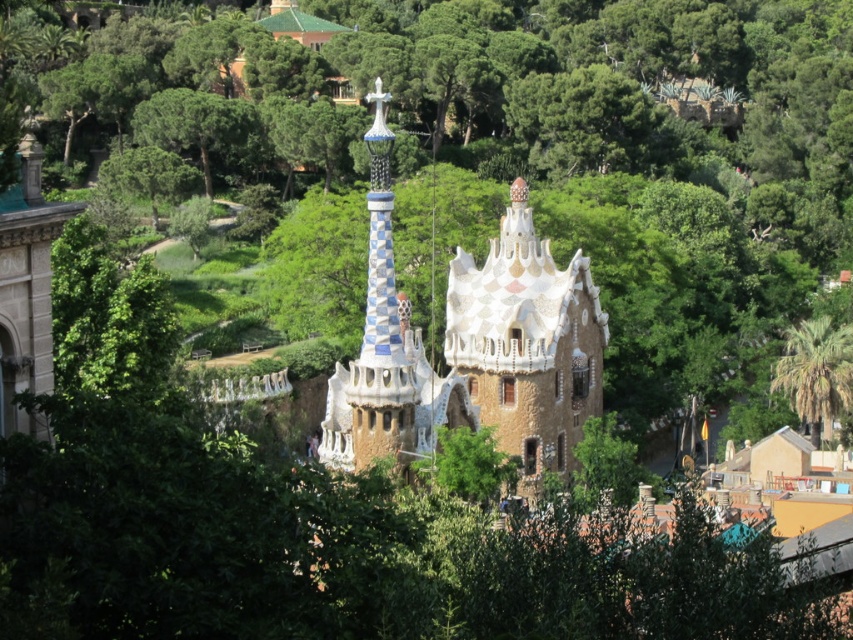
Can you confirm if white mosaic tower at center is taller than white mosaic spire at center?

Incorrect, white mosaic tower at center's height is not larger of white mosaic spire at center's.

Measure the distance between point [492,296] and camera.

The distance of point [492,296] from camera is 118.29 meters.

Who is more forward, [498,342] or [375,390]?

Point [375,390] is in front.

The image size is (853, 640). What are the coordinates of `white mosaic tower at center` in the screenshot? It's located at (527, 342).

Describe the element at coordinates (380, 324) in the screenshot. This screenshot has height=640, width=853. I see `white mosaic spire at center` at that location.

Based on the photo, does white mosaic spire at center lie in front of green leafy palm tree at right?

Yes, it is in front of green leafy palm tree at right.

Which is behind, point (383, 140) or point (817, 426)?

The point (817, 426) is more distant.

The height and width of the screenshot is (640, 853). What are the coordinates of `white mosaic spire at center` in the screenshot? It's located at (380, 324).

Is white mosaic tower at center in front of green leafy palm tree at right?

Yes, white mosaic tower at center is closer to the viewer.

Is point (523, 240) closer to viewer compared to point (799, 388)?

Yes, point (523, 240) is in front of point (799, 388).

Find the location of a particular element. Image resolution: width=853 pixels, height=640 pixels. white mosaic tower at center is located at coordinates (527, 342).